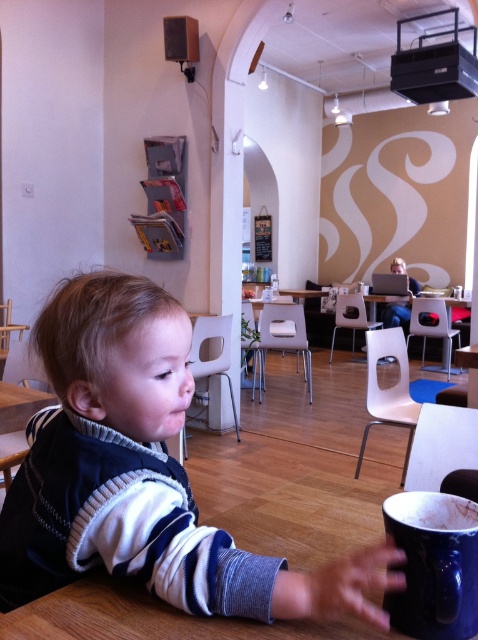
You are a customer in the cozy cafe and want to place your order. The barista tells you that your drink is ready and is located at point (142, 474). Which object at this coordinate should you look for?

The dark blue sweater at center is located at point (142, 474), so you should look for the dark blue sweater at center there.

You are a barista in the cafe and need to place the dark blue sweater at center and the blue ceramic mug at lower right on a shelf. The shelf has a width of 1 meter. Can both items fit side by side without overlapping?

The dark blue sweater at center is larger in size than the blue ceramic mug at lower right, but the exact dimensions are not provided. However, since the shelf is 1 meter wide, it is likely that both items can fit side by side if the combined width of the sweater and mug does not exceed 1 meter. Without specific measurements, we cannot confirm for certain, but there is a possibility they can fit.

You are a customer in the cafe and want to place your phone on the table. The table has a dark blue sweater at center. Where should you place your phone so it doesn not interfere with the sweater?

Place the phone away from the dark blue sweater at center, as its location is at point (x=142, y=474). Avoid placing the phone near that coordinate to prevent interference.